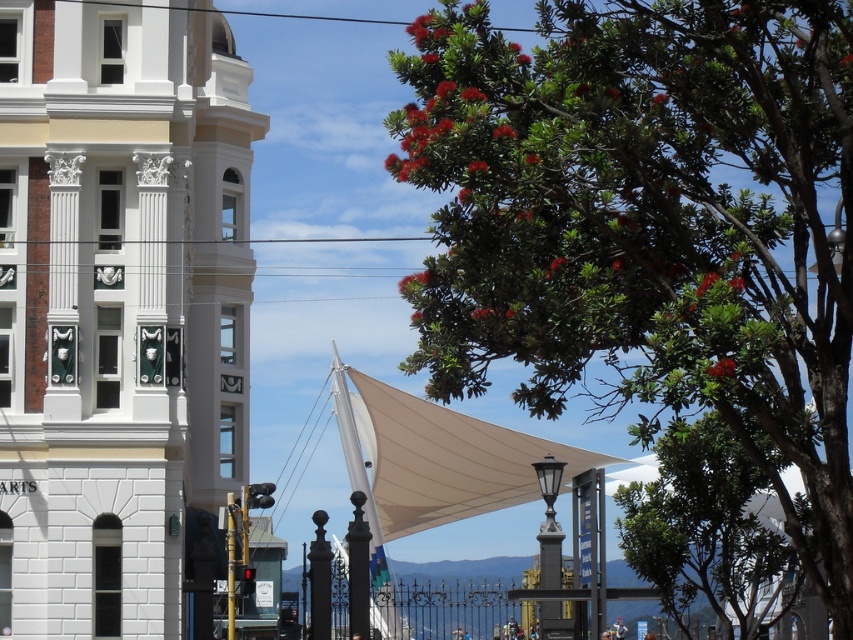
You are standing in the urban scene depicted. There is a point marked at coordinates (117, 305). Which object does this point correspond to?

The point at coordinates (117, 305) corresponds to the white stone bell tower at left.

Based on the photo, you are a tourist standing in the middle of the square. You see the white stone bell tower at left and the green leafy tree at center. Which object is higher from the ground?

The white stone bell tower at left is located above the green leafy tree at center, so it is higher from the ground.